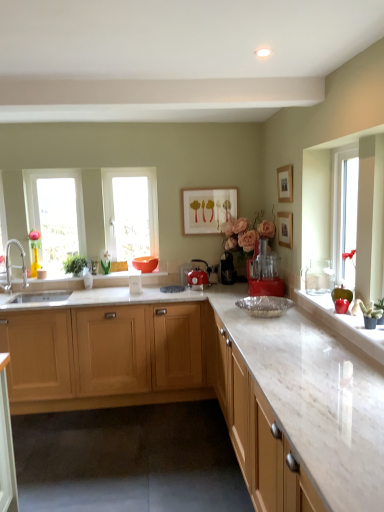
Question: Considering the relative sizes of matte wooden picture frame at center, marked as the third picture frame in a front-to-back arrangement, and transparent glass window at center, placed as the 1th window when sorted from right to left, in the image provided, is matte wooden picture frame at center, marked as the third picture frame in a front-to-back arrangement, smaller than transparent glass window at center, placed as the 1th window when sorted from right to left,?

Choices:
 (A) no
 (B) yes

Answer: (B)

Question: From the image's perspective, is matte wooden picture frame at center, the 3th picture frame in the right-to-left sequence, located above transparent glass window at center, placed as the 1th window when sorted from right to left?

Choices:
 (A) yes
 (B) no

Answer: (A)

Question: Can you confirm if matte wooden picture frame at center, which ranks as the 1th picture frame in left-to-right order, is thinner than transparent glass window at center, placed as the 1th window when sorted from right to left?

Choices:
 (A) no
 (B) yes

Answer: (B)

Question: From the image's perspective, does matte wooden picture frame at center, marked as the third picture frame in a front-to-back arrangement, appear lower than transparent glass window at center, placed as the 1th window when sorted from right to left?

Choices:
 (A) no
 (B) yes

Answer: (A)

Question: Can you confirm if matte wooden picture frame at center, marked as the third picture frame in a front-to-back arrangement, is shorter than transparent glass window at center, which ranks as the 2th window in left-to-right order?

Choices:
 (A) yes
 (B) no

Answer: (A)

Question: From their relative heights in the image, would you say transparent glass window at left, the first window when ordered from left to right, is taller or shorter than satin nickel faucet at left?

Choices:
 (A) tall
 (B) short

Answer: (A)

Question: Considering the positions of point (51, 169) and point (9, 282), is point (51, 169) closer or farther from the camera than point (9, 282)?

Choices:
 (A) closer
 (B) farther

Answer: (A)

Question: From the image's perspective, is transparent glass window at left, the first window when ordered from left to right, positioned above or below satin nickel faucet at left?

Choices:
 (A) above
 (B) below

Answer: (A)

Question: From a real-world perspective, relative to satin nickel faucet at left, is transparent glass window at left, the first window when ordered from left to right, vertically above or below?

Choices:
 (A) above
 (B) below

Answer: (A)

Question: Does point (231, 269) appear closer or farther from the camera than point (74, 271)?

Choices:
 (A) farther
 (B) closer

Answer: (B)

Question: From the image's perspective, is black plastic coffee machine at center, the second coffee machine viewed from the right, above or below green leafy plant at left, the second plant from the bottom?

Choices:
 (A) above
 (B) below

Answer: (B)

Question: Would you say black plastic coffee machine at center, which is the 1th coffee machine from left to right, is to the left or to the right of green leafy plant at left, which is the first plant in top-to-bottom order, in the picture?

Choices:
 (A) left
 (B) right

Answer: (B)

Question: Is black plastic coffee machine at center, the second coffee machine viewed from the right, inside the boundaries of green leafy plant at left, which is the first plant in top-to-bottom order, or outside?

Choices:
 (A) inside
 (B) outside

Answer: (B)

Question: Looking at their shapes, would you say white marble countertop at right, the second cabinetry from the back, is wider or thinner than matte orange bowl at center?

Choices:
 (A) thin
 (B) wide

Answer: (B)

Question: In terms of size, does white marble countertop at right, the second cabinetry from the back, appear bigger or smaller than matte orange bowl at center?

Choices:
 (A) big
 (B) small

Answer: (A)